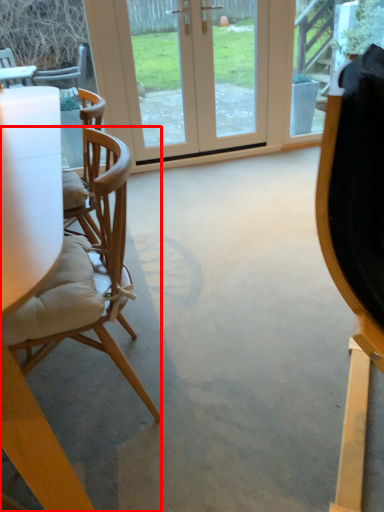
Question: From the image, what is the correct spatial relationship of chair (annotated by the red box) in relation to door?

Choices:
 (A) left
 (B) right

Answer: (A)